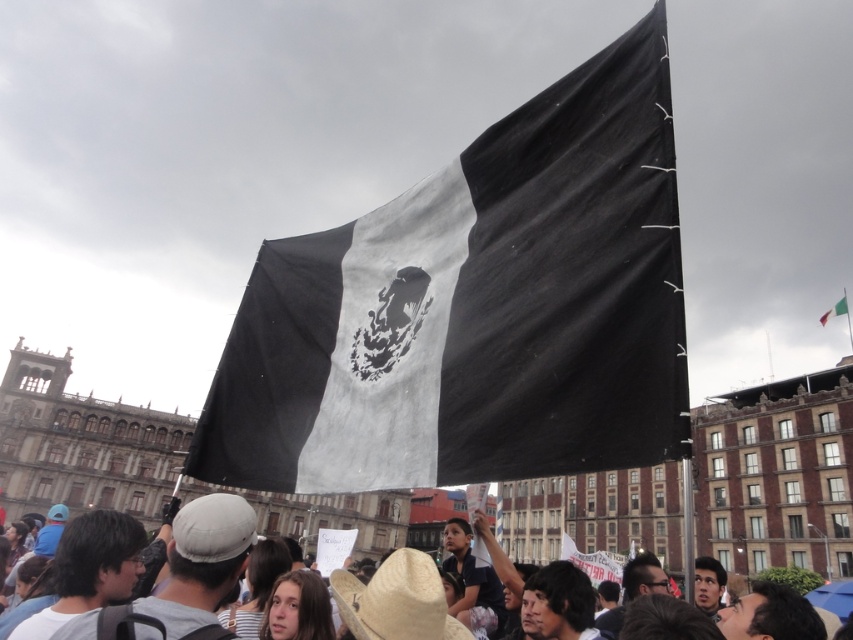
You are a photographer trying to capture the black fabric flag at center and the white fabric flag at upper center in a single shot. Which flag should you adjust your camera angle to focus on first to ensure both are in frame?

The black fabric flag at center is positioned under the white fabric flag at upper center, so you should focus on the white fabric flag at upper center first to ensure both are in frame.

You are a photographer positioned at the camera location. You want to capture a closeup shot of the black fabric flag at center. Given that your camera can focus on objects within 25 meters, will you be able to take the photo without moving closer?

The distance between the black fabric flag at center and the camera is 27.51 meters, which is beyond the camera focus range of 25 meters. Therefore, you cannot take the closeup shot without moving closer.